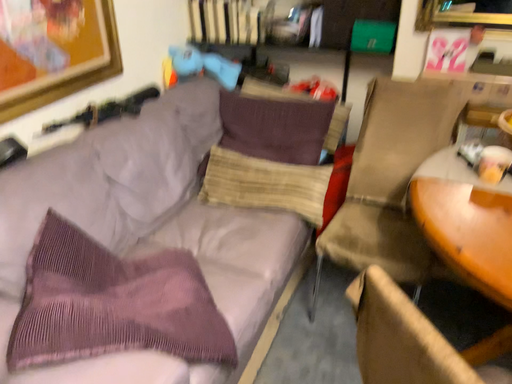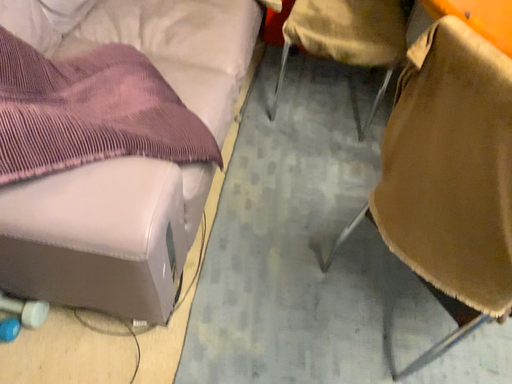
Question: How did the camera likely rotate when shooting the video?

Choices:
 (A) rotated right
 (B) rotated left

Answer: (A)